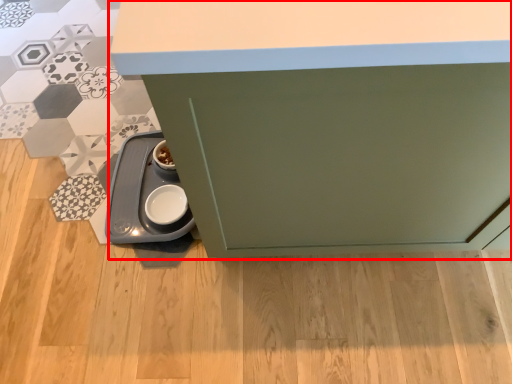
Question: In this image, where is cabinetry (annotated by the red box) located relative to appliance?

Choices:
 (A) right
 (B) left

Answer: (A)